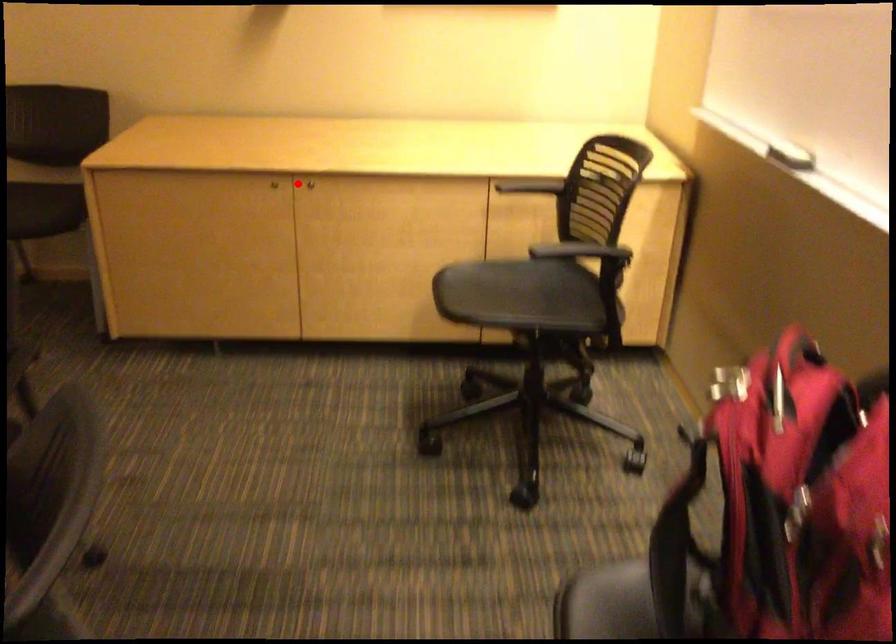
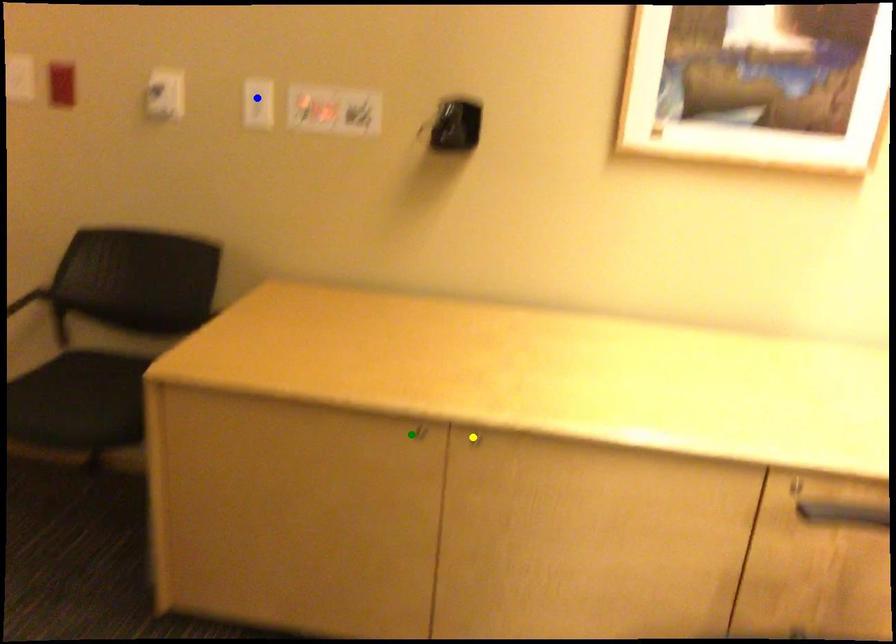
Question: I am providing you with two images of the same scene from different viewpoints. A red point is marked on the first image. You are given multiple points on the second image. Which point in image 2 is actually the same real-world point as the red point in image 1?

Choices:
 (A) green point
 (B) blue point
 (C) yellow point

Answer: (C)